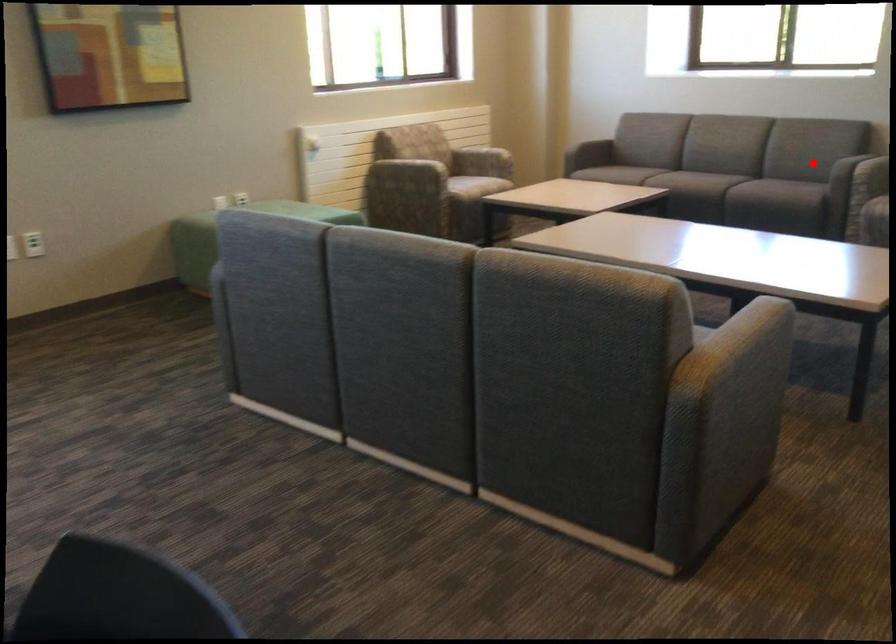
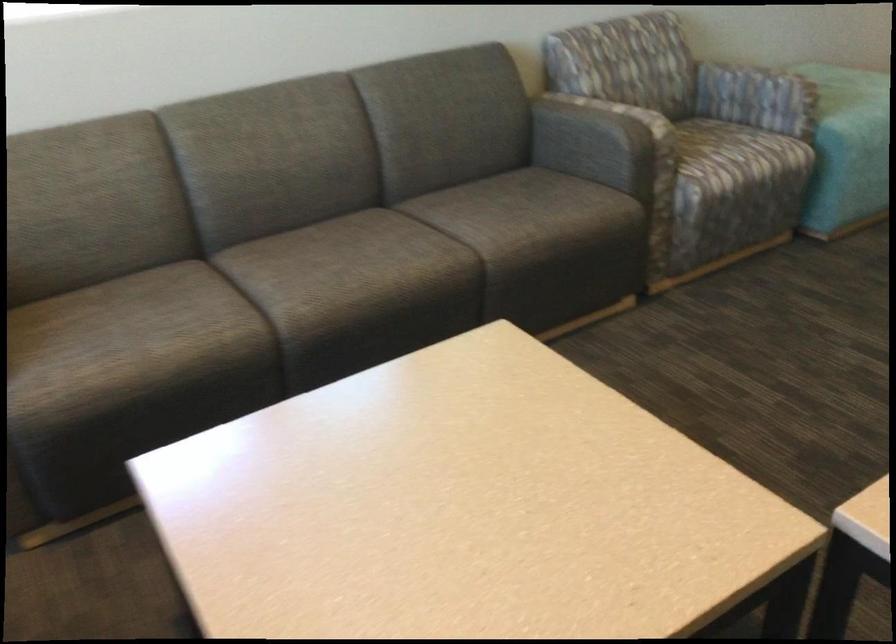
In the second image, find the point that corresponds to the highlighted location in the first image.

(597, 140)